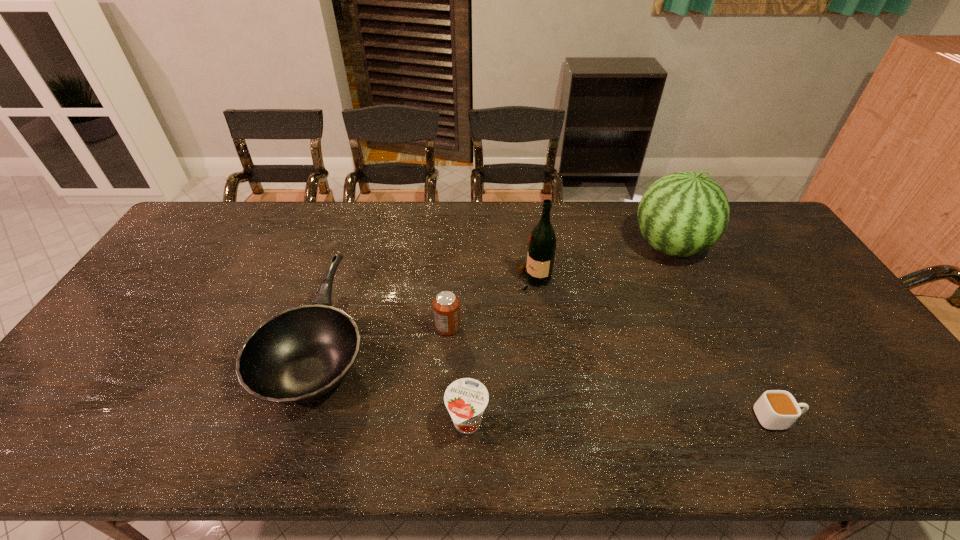
Image resolution: width=960 pixels, height=540 pixels. In the image, there is a desktop. What are the coordinates of `free space at the left edge` in the screenshot? It's located at (169, 256).

Where is `vacant region at the right edge of the desktop`? The height and width of the screenshot is (540, 960). vacant region at the right edge of the desktop is located at coordinates (810, 323).

In the image, there is a desktop. Identify the location of free space at the far left corner. This screenshot has height=540, width=960. (237, 215).

Locate an element on the screen. Image resolution: width=960 pixels, height=540 pixels. vacant space at the far right corner is located at coordinates (764, 217).

Image resolution: width=960 pixels, height=540 pixels. Find the location of `free space between the yogurt and the can`. free space between the yogurt and the can is located at coordinates (458, 375).

Find the location of a particular element. The width and height of the screenshot is (960, 540). blank region between the shortest object and the can is located at coordinates (612, 373).

The width and height of the screenshot is (960, 540). I want to click on vacant point located between the watermelon and the wine bottle, so click(x=601, y=264).

At what (x,y) coordinates should I click in order to perform the action: click on unoccupied area between the watermelon and the can. Please return your answer as a coordinate pair (x, y). The height and width of the screenshot is (540, 960). Looking at the image, I should click on (559, 287).

Locate an element on the screen. This screenshot has height=540, width=960. vacant point located between the can and the leftmost object is located at coordinates (384, 334).

You are a GUI agent. You are given a task and a screenshot of the screen. Output one action in this format:
    pyautogui.click(x=<x>, y=<y>)
    Task: Click on the free spot between the watermelon and the frying pan
    This screenshot has height=540, width=960.
    Given the screenshot: What is the action you would take?
    pyautogui.click(x=495, y=294)